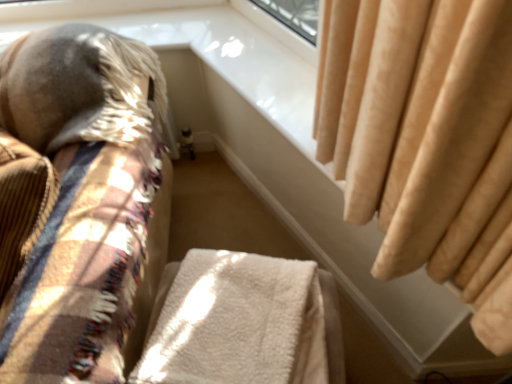
Question: In the image, is white fluffy blanket at center positioned in front of or behind beige velvet curtain at upper right?

Choices:
 (A) front
 (B) behind

Answer: (A)

Question: Is white fluffy blanket at center bigger or smaller than beige velvet curtain at upper right?

Choices:
 (A) big
 (B) small

Answer: (B)

Question: Considering the real-world distances, which object is farthest from the soft beige fabric cushion at left?

Choices:
 (A) beige velvet curtain at upper right
 (B) white fluffy blanket at center

Answer: (A)

Question: Estimate the real-world distances between objects in this image. Which object is farther from the beige velvet curtain at upper right?

Choices:
 (A) white fluffy blanket at center
 (B) soft beige fabric cushion at left

Answer: (B)